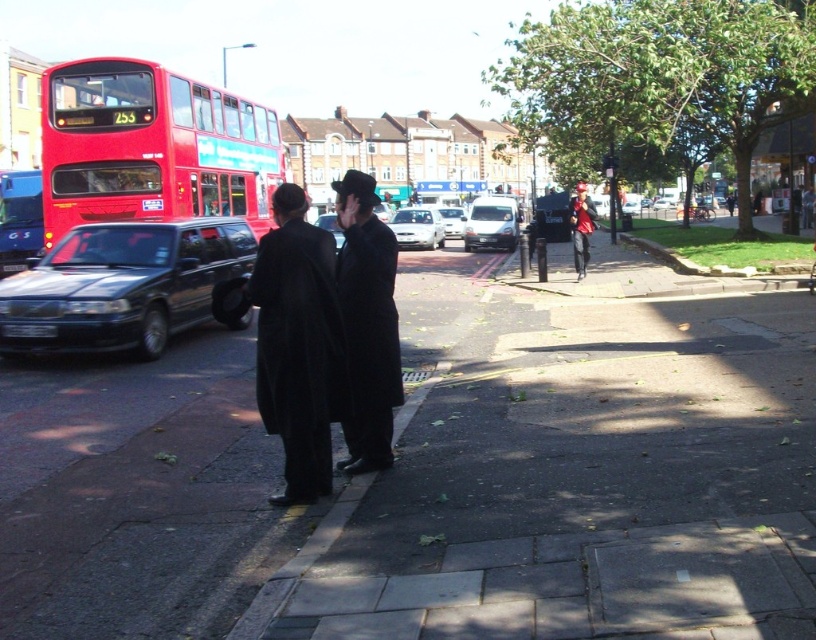
Can you confirm if white matte van at center is positioned to the left of red fabric jacket at center?

Yes, white matte van at center is to the left of red fabric jacket at center.

Which of these two, white matte van at center or red fabric jacket at center, stands taller?

white matte van at center

Find the location of a particular element. The width and height of the screenshot is (816, 640). white matte van at center is located at coordinates (491, 224).

You are a GUI agent. You are given a task and a screenshot of the screen. Output one action in this format:
    pyautogui.click(x=<x>, y=<y>)
    Task: Click on the white matte van at center
    The width and height of the screenshot is (816, 640).
    Given the screenshot: What is the action you would take?
    pyautogui.click(x=491, y=224)

Based on the photo, is dark gray concrete sidewalk at center wider than matte black station wagon at left?

Yes.

Looking at this image, is dark gray concrete sidewalk at center further to the viewer compared to matte black station wagon at left?

No, dark gray concrete sidewalk at center is in front of matte black station wagon at left.

Who is more distant from viewer, [40,394] or [247,243]?

Positioned behind is point [247,243].

Locate an element on the screen. dark gray concrete sidewalk at center is located at coordinates (138, 493).

Which is below, dark gray concrete sidewalk at center or shiny black car at center?

dark gray concrete sidewalk at center is lower down.

Which is in front, point (144, 556) or point (322, 225)?

Point (144, 556) is in front.

This screenshot has height=640, width=816. Describe the element at coordinates (138, 493) in the screenshot. I see `dark gray concrete sidewalk at center` at that location.

Find the location of `dark gray concrete sidewalk at center`. dark gray concrete sidewalk at center is located at coordinates (138, 493).